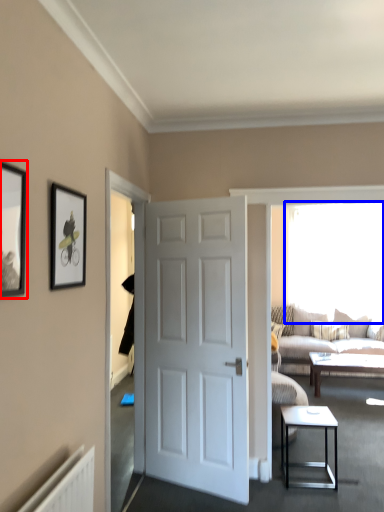
Question: Which object appears closest to the camera in this image, picture frame (highlighted by a red box) or window screen (highlighted by a blue box)?

Choices:
 (A) picture frame
 (B) window screen

Answer: (A)